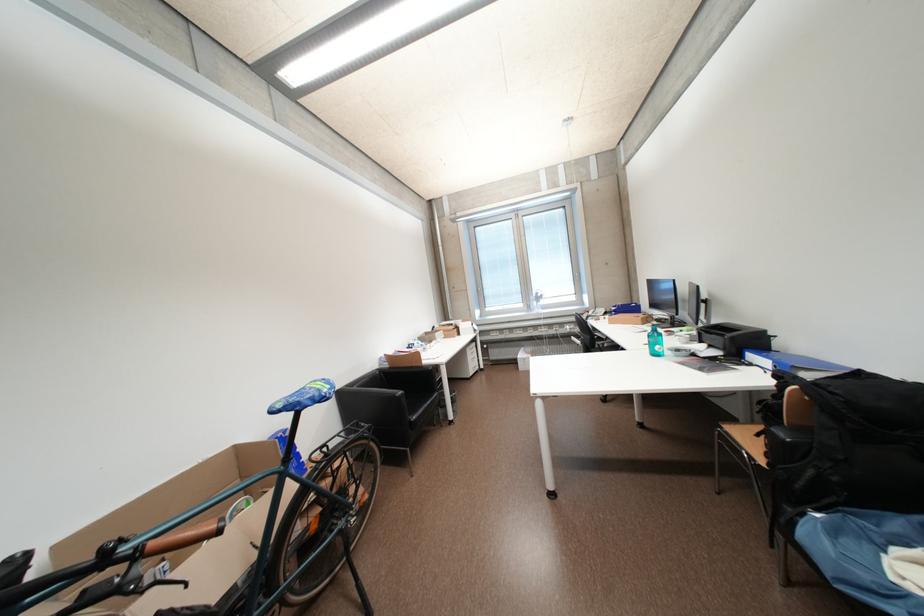
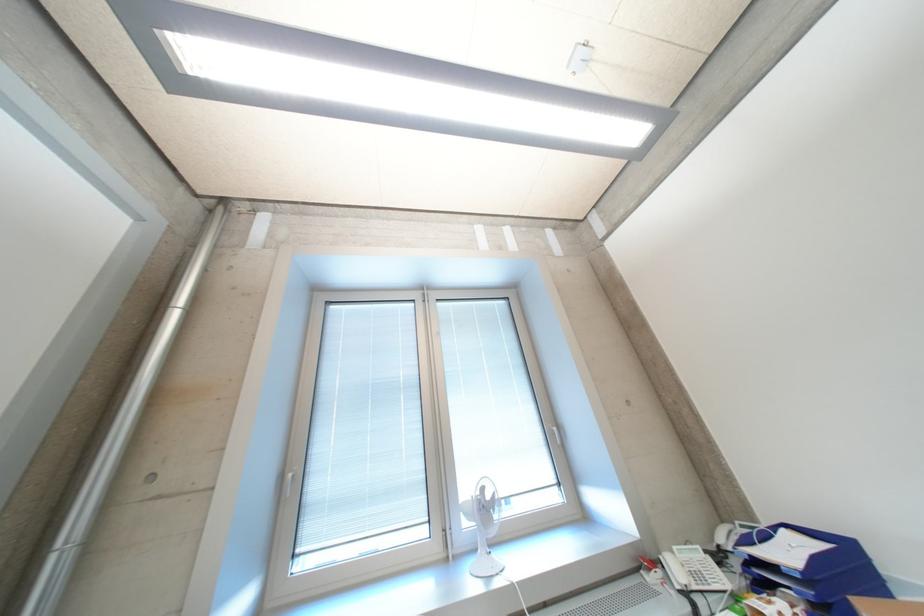
Find the pixel in the second image that matches (546,300) in the first image.

(492, 509)